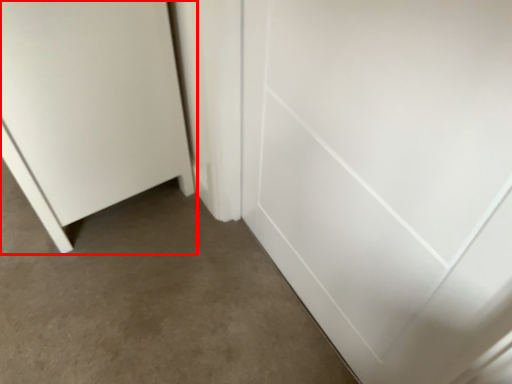
Question: From the image, what is the correct spatial relationship of door (annotated by the red box) in relation to door?

Choices:
 (A) right
 (B) left

Answer: (B)